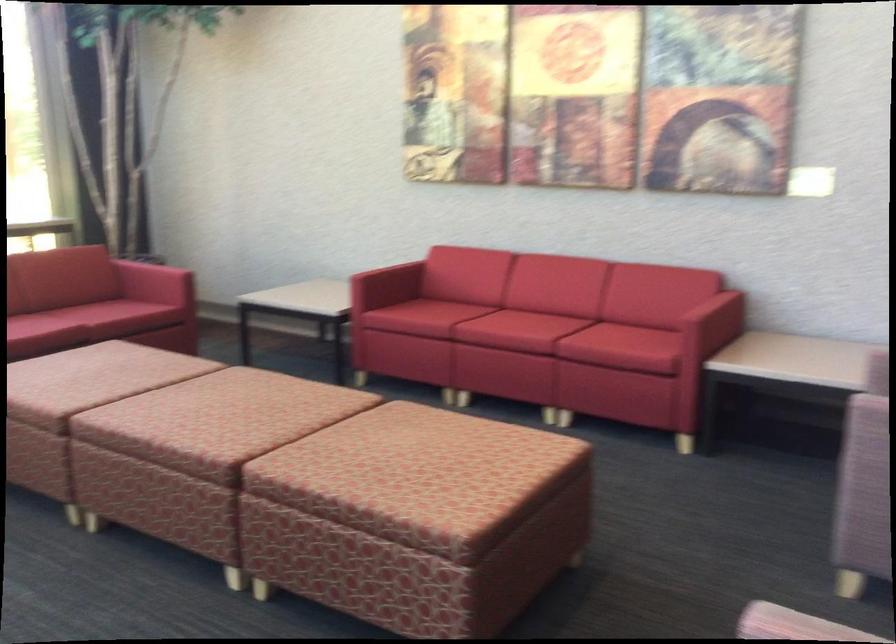
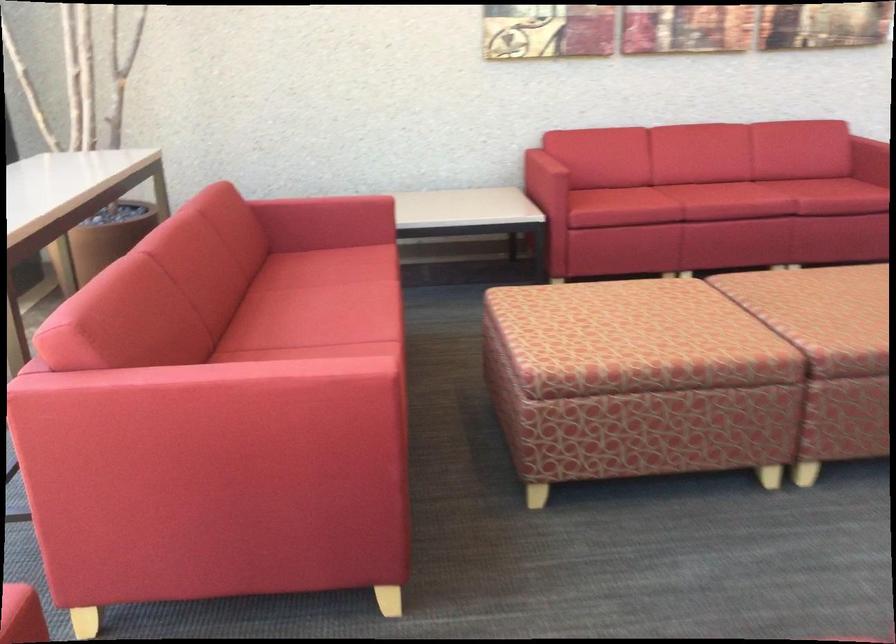
Find the pixel in the second image that matches (x=479, y=327) in the first image.

(725, 201)